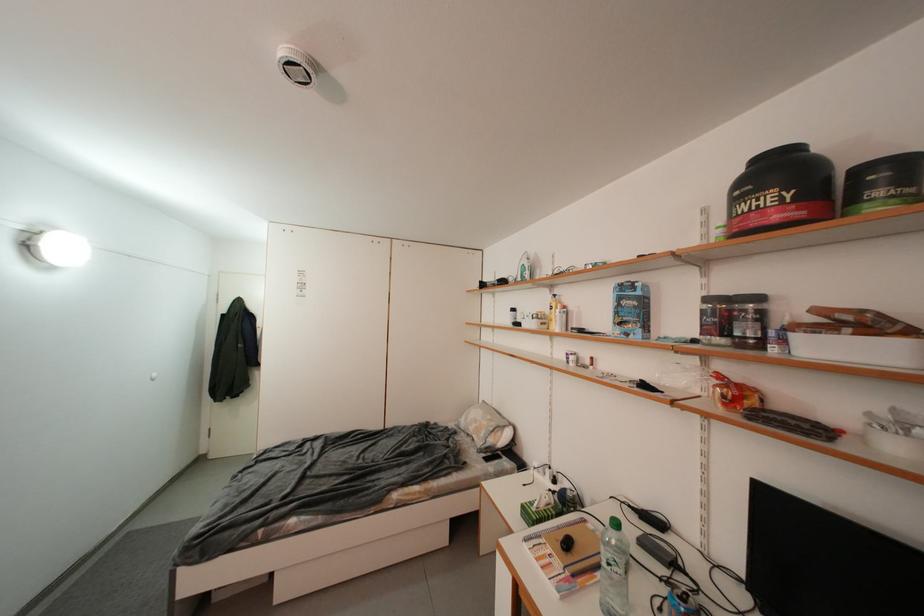
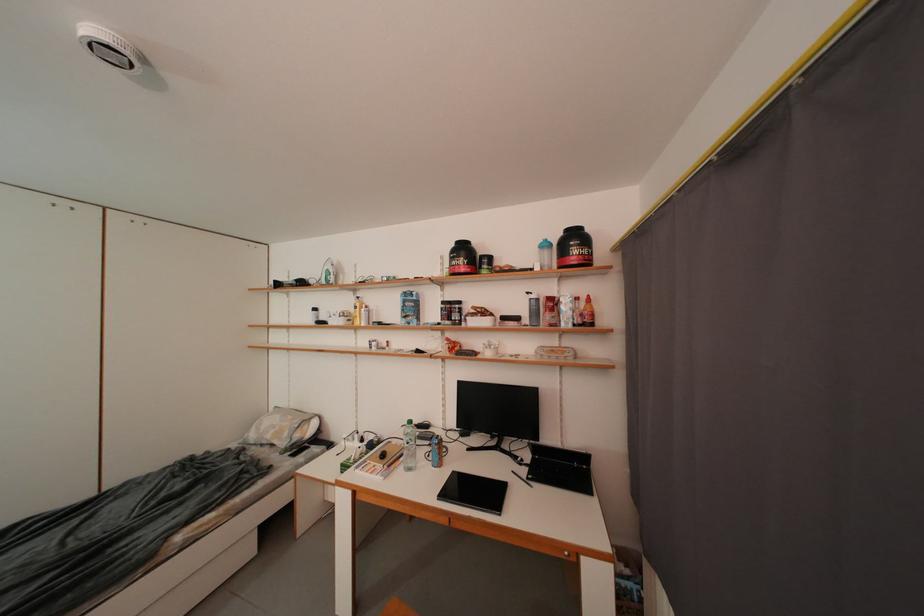
Where in the second image is the point corresponding to point (606, 578) from the first image?

(409, 462)